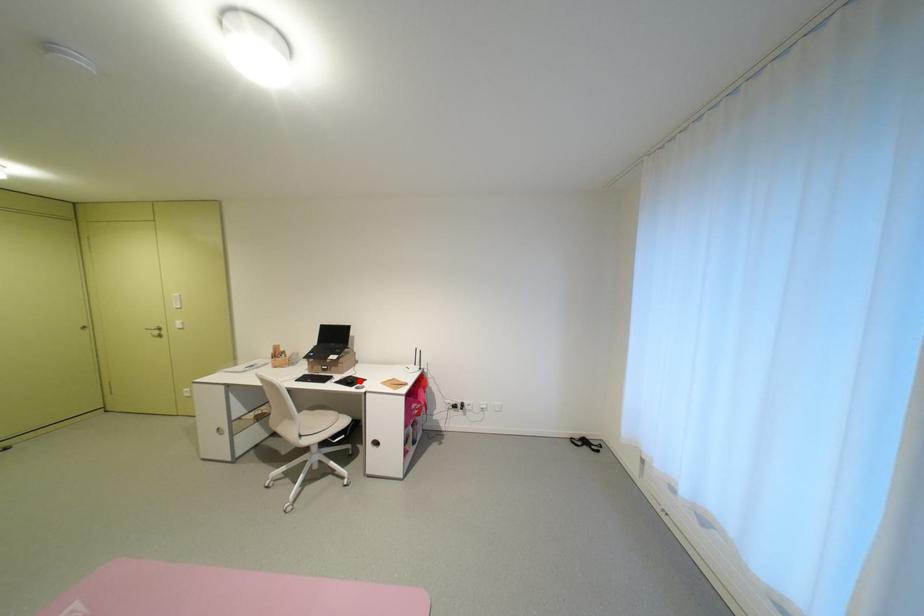
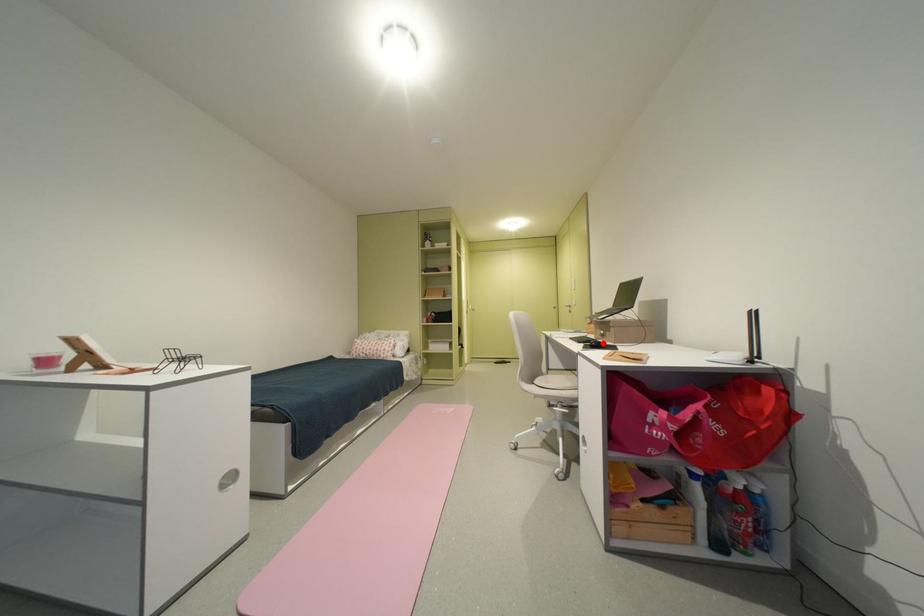
I am providing you with two images of the same scene from different viewpoints. A red point is marked on the first image and another point is marked on the second image. Is the red point in image1 aligned with the point shown in image2?

Yes